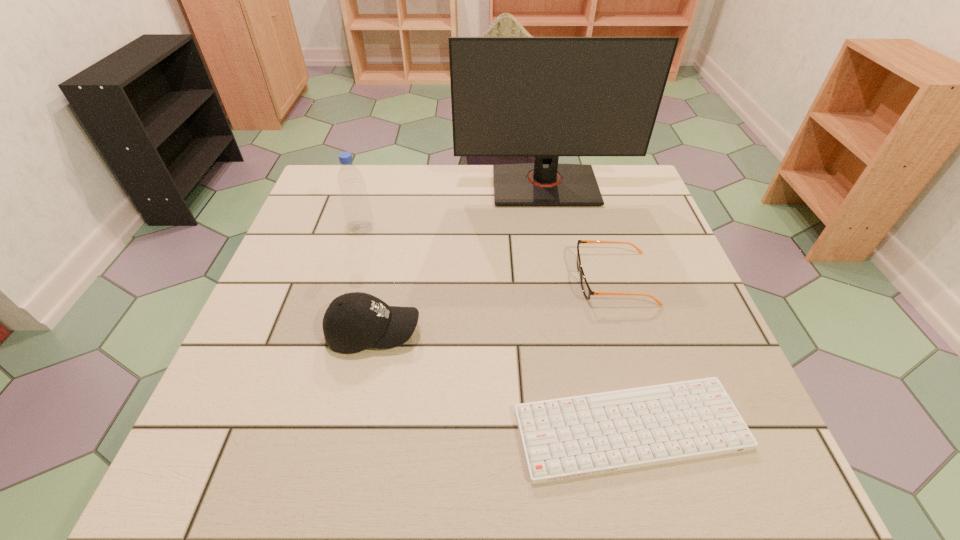
Locate an element on the screen. This screenshot has height=540, width=960. vacant region located on the screen side of the tallest object is located at coordinates (555, 241).

This screenshot has width=960, height=540. What are the coordinates of `vacant space located 0.080m on the left of the bottle` in the screenshot? It's located at (318, 229).

What are the coordinates of `free space located 0.290m on the front-facing side of the third shortest object` in the screenshot? It's located at pyautogui.click(x=563, y=333).

The image size is (960, 540). What are the coordinates of `vacant space located on the front-facing side of the third farthest object` in the screenshot? It's located at (442, 279).

Where is `vacant space positioned 0.230m on the front-facing side of the third farthest object`? The height and width of the screenshot is (540, 960). vacant space positioned 0.230m on the front-facing side of the third farthest object is located at coordinates (476, 279).

The height and width of the screenshot is (540, 960). What are the coordinates of `free region located 0.160m on the front-facing side of the third farthest object` in the screenshot? It's located at (507, 279).

Find the location of a particular element. The width and height of the screenshot is (960, 540). vacant space situated on the back of the nearest object is located at coordinates (589, 267).

Identify the location of object located at the far edge. The width and height of the screenshot is (960, 540). (546, 97).

Where is `object at the near edge`? The height and width of the screenshot is (540, 960). object at the near edge is located at coordinates (564, 438).

The image size is (960, 540). Identify the location of bottle at the left edge. (359, 218).